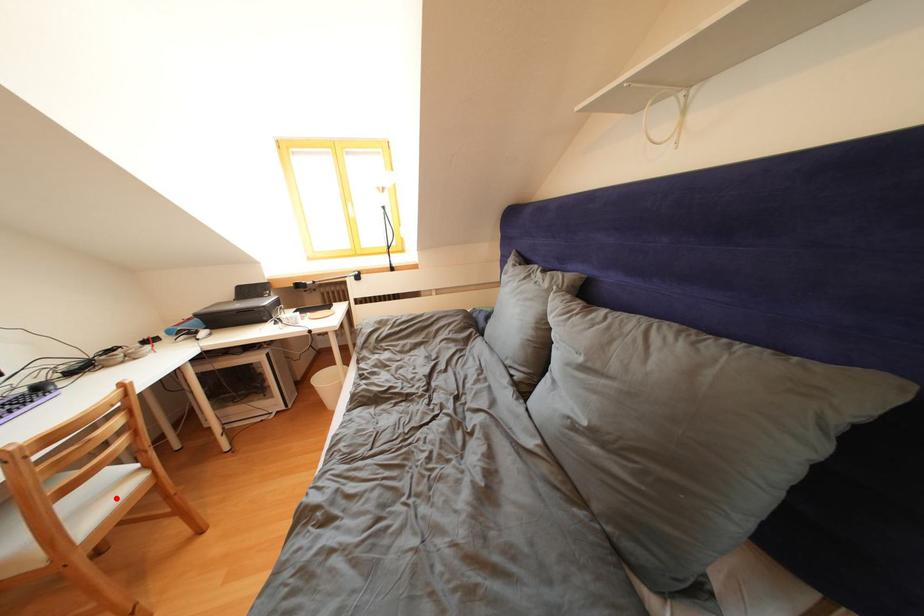
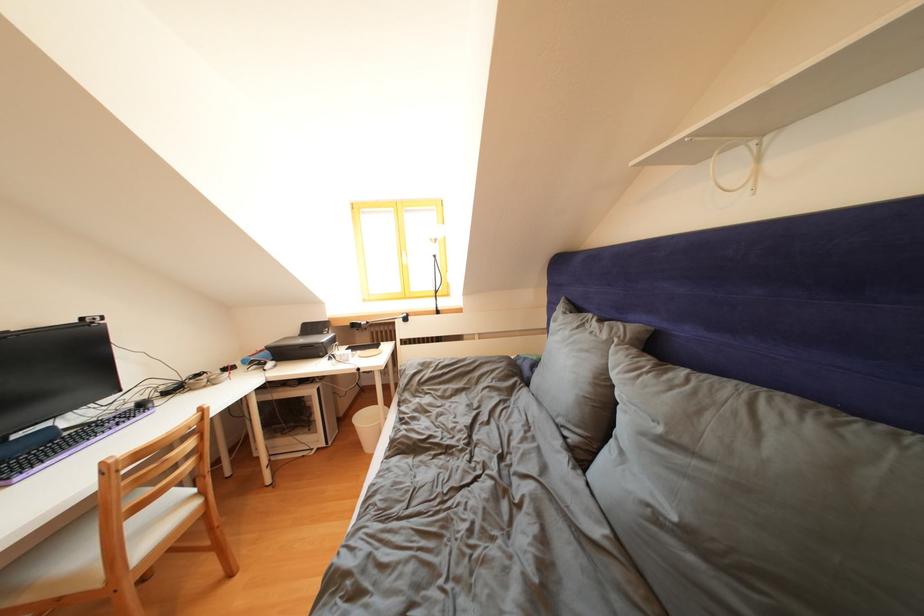
The point at the highlighted location is marked in the first image. Where is the corresponding point in the second image?

(175, 522)